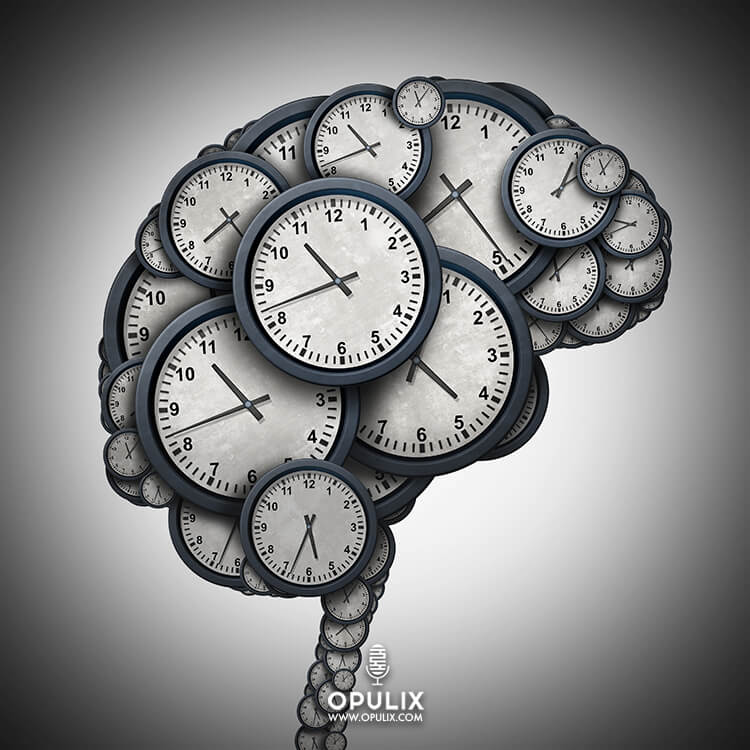
The width and height of the screenshot is (750, 750). Find the location of `clock reading 10:42`. clock reading 10:42 is located at coordinates (370, 138), (345, 256), (254, 379).